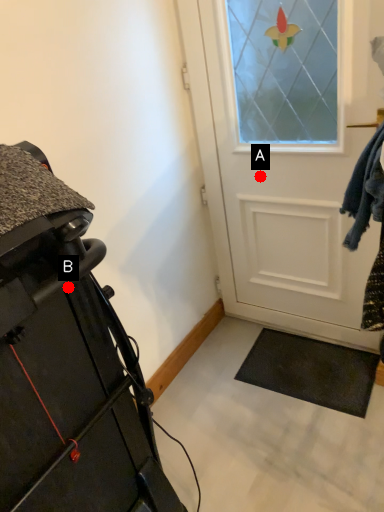
Question: Two points are circled on the image, labeled by A and B beside each circle. Which point is farther to the camera?

Choices:
 (A) A is further
 (B) B is further

Answer: (A)